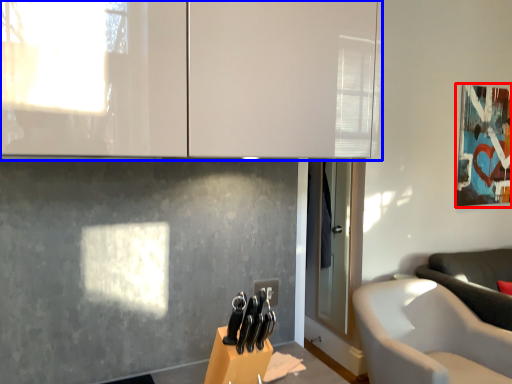
Question: Among these objects, which one is farthest to the camera, picture frame (highlighted by a red box) or cabinetry (highlighted by a blue box)?

Choices:
 (A) picture frame
 (B) cabinetry

Answer: (A)